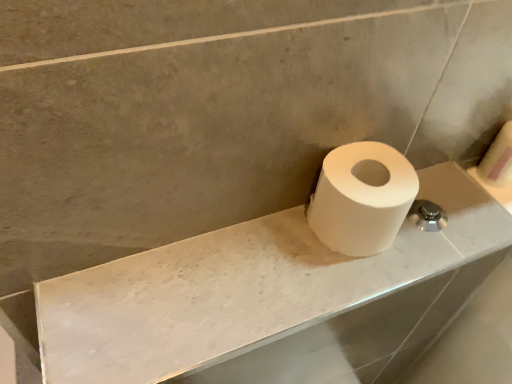
Question: Is white matte toilet paper at right, the second toilet paper positioned from the left, facing towards white matte toilet paper at right, which is the 1th toilet paper from front to back?

Choices:
 (A) yes
 (B) no

Answer: (B)

Question: Is white matte toilet paper at right, the first toilet paper from the right, next to white matte toilet paper at right, which is the 1th toilet paper from front to back, and touching it?

Choices:
 (A) yes
 (B) no

Answer: (B)

Question: Considering the relative sizes of white matte toilet paper at right, the 1th toilet paper positioned from the back, and white matte toilet paper at right, positioned as the 2th toilet paper in back-to-front order, in the image provided, is white matte toilet paper at right, the 1th toilet paper positioned from the back, thinner than white matte toilet paper at right, positioned as the 2th toilet paper in back-to-front order,?

Choices:
 (A) yes
 (B) no

Answer: (A)

Question: Can you confirm if white matte toilet paper at right, the 1th toilet paper positioned from the back, is taller than white matte toilet paper at right, positioned as the 2th toilet paper in back-to-front order?

Choices:
 (A) yes
 (B) no

Answer: (A)

Question: Considering the relative sizes of white matte toilet paper at right, the 1th toilet paper positioned from the back, and white matte toilet paper at right, which ranks as the first toilet paper in left-to-right order, in the image provided, is white matte toilet paper at right, the 1th toilet paper positioned from the back, shorter than white matte toilet paper at right, which ranks as the first toilet paper in left-to-right order,?

Choices:
 (A) no
 (B) yes

Answer: (A)

Question: Can white matte toilet paper at right, positioned as the 2th toilet paper in back-to-front order, be found inside white matte toilet paper at right, the first toilet paper from the right?

Choices:
 (A) yes
 (B) no

Answer: (B)

Question: Considering the relative sizes of white matte toilet paper at right, the second toilet paper positioned from the left, and white marble counter top at center in the image provided, is white matte toilet paper at right, the second toilet paper positioned from the left, bigger than white marble counter top at center?

Choices:
 (A) no
 (B) yes

Answer: (A)

Question: Is white matte toilet paper at right, the second toilet paper from the front, looking in the opposite direction of white marble counter top at center?

Choices:
 (A) no
 (B) yes

Answer: (A)

Question: Considering the relative sizes of white matte toilet paper at right, the second toilet paper from the front, and white marble counter top at center in the image provided, is white matte toilet paper at right, the second toilet paper from the front, shorter than white marble counter top at center?

Choices:
 (A) yes
 (B) no

Answer: (B)

Question: Does white matte toilet paper at right, the 1th toilet paper positioned from the back, have a smaller size compared to white marble counter top at center?

Choices:
 (A) no
 (B) yes

Answer: (B)

Question: Would you say white marble counter top at center is part of white matte toilet paper at right, the second toilet paper positioned from the left,'s contents?

Choices:
 (A) no
 (B) yes

Answer: (A)

Question: Can we say white matte toilet paper at right, the 1th toilet paper positioned from the back, lies outside white marble counter top at center?

Choices:
 (A) yes
 (B) no

Answer: (A)

Question: Can white matte toilet paper at right, the second toilet paper positioned from the left, be found inside white marble counter top at center?

Choices:
 (A) yes
 (B) no

Answer: (B)